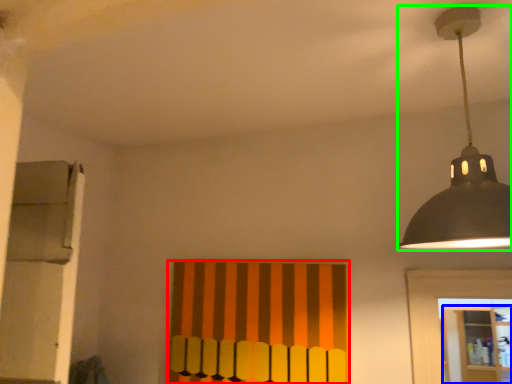
Question: Estimate the real-world distances between objects in this image. Which object is farther from curtain (highlighted by a red box), shelf (highlighted by a blue box) or lamp (highlighted by a green box)?

Choices:
 (A) shelf
 (B) lamp

Answer: (A)